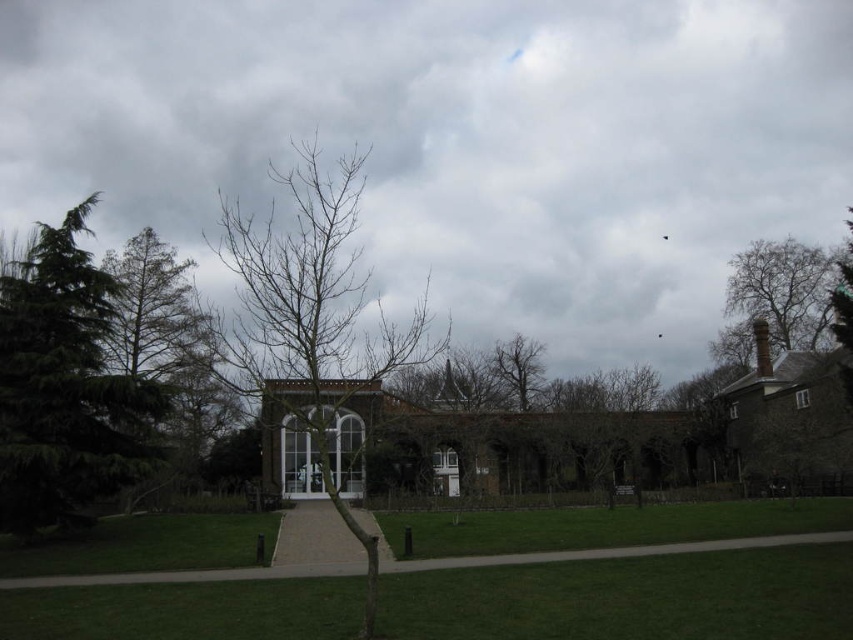
You are standing at the entrance of the large historic building and want to reach the green grass at center. Which direction should you walk to get there?

The green grass at center is located at coordinates point (630, 598), which is to the front and center of the building. To reach it, walk straight ahead from the entrance towards the center of the lawn.

Consider the image. You are a landscape architect designing a new garden. You need to place a 3m wide decorative fountain between the green grass at center and the bare branches at center. Can the space between them accommodate the fountain?

The green grass at center has a width less than the bare branches at center. However, the exact distance between them isn not provided in the description. Without knowing the distance between the two objects, it is impossible to determine if the 3m wide fountain will fit.